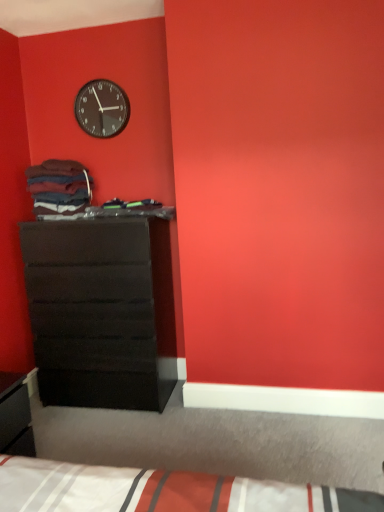
The width and height of the screenshot is (384, 512). I want to click on matte black chest of drawers at left, so click(99, 311).

Is matte black chest of drawers at left in front of matte black clock at upper left?

Yes, matte black chest of drawers at left is in front of matte black clock at upper left.

What's the angular difference between matte black chest of drawers at left and matte black clock at upper left's facing directions?

They differ by 2.42 degrees in their facing directions.

Is matte black chest of drawers at left not close to matte black clock at upper left?

Yes, matte black chest of drawers at left and matte black clock at upper left are quite far apart.

Who is bigger, matte black chest of drawers at left or matte black clock at upper left?

Bigger between the two is matte black chest of drawers at left.

Locate an element on the screen. Image resolution: width=384 pixels, height=512 pixels. bed below the matte black clock at upper left (from the image's perspective) is located at coordinates (161, 490).

Is white striped fabric bed at lower center wider than matte black clock at upper left?

Correct, the width of white striped fabric bed at lower center exceeds that of matte black clock at upper left.

Is the surface of white striped fabric bed at lower center in direct contact with matte black clock at upper left?

There is a gap between white striped fabric bed at lower center and matte black clock at upper left.

Is matte black chest of drawers at left not within white striped fabric bed at lower center?

matte black chest of drawers at left is positioned outside white striped fabric bed at lower center.

How different are the orientations of matte black chest of drawers at left and white striped fabric bed at lower center in degrees?

The facing directions of matte black chest of drawers at left and white striped fabric bed at lower center are 88.4 degrees apart.

Is matte black chest of drawers at left looking in the opposite direction of white striped fabric bed at lower center?

No, white striped fabric bed at lower center is not at the back of matte black chest of drawers at left.

Can you confirm if matte black chest of drawers at left is bigger than white striped fabric bed at lower center?

Indeed, matte black chest of drawers at left has a larger size compared to white striped fabric bed at lower center.

In the scene shown: Is matte black clock at upper left outside of matte black chest of drawers at left?

matte black clock at upper left is positioned outside matte black chest of drawers at left.

From the image's perspective, does matte black clock at upper left appear lower than matte black chest of drawers at left?

Actually, matte black clock at upper left appears above matte black chest of drawers at left in the image.

How much distance is there between matte black clock at upper left and matte black chest of drawers at left?

The distance of matte black clock at upper left from matte black chest of drawers at left is 1.13 meters.

Is matte black clock at upper left aimed at matte black chest of drawers at left?

No, matte black clock at upper left is not aimed at matte black chest of drawers at left.

Which is behind, point (108, 89) or point (74, 501)?

Point (108, 89)

Can white striped fabric bed at lower center be found inside matte black clock at upper left?

Actually, white striped fabric bed at lower center is outside matte black clock at upper left.

Identify the location of bed on the right side of matte black clock at upper left. (161, 490).

Is white striped fabric bed at lower center in front of or behind matte black chest of drawers at left in the image?

Clearly, white striped fabric bed at lower center is in front of matte black chest of drawers at left.

From the image's perspective, relative to matte black chest of drawers at left, is white striped fabric bed at lower center above or below?

From the image's perspective, white striped fabric bed at lower center appears below matte black chest of drawers at left.

Consider the image. Considering the relative sizes of white striped fabric bed at lower center and matte black chest of drawers at left in the image provided, is white striped fabric bed at lower center wider than matte black chest of drawers at left?

Yes.

Which is in front, point (316, 504) or point (118, 274)?

Positioned in front is point (316, 504).

Locate an element on the screen. the chest of drawers beneath the matte black clock at upper left (from a real-world perspective) is located at coordinates click(99, 311).

In order to click on wall clock located behind the white striped fabric bed at lower center in this screenshot , I will do `click(102, 108)`.

From the image, which object appears to be farther from matte black clock at upper left, matte black chest of drawers at left or white striped fabric bed at lower center?

Based on the image, white striped fabric bed at lower center appears to be further to matte black clock at upper left.

Looking at the image, which one is located closer to matte black clock at upper left, white striped fabric bed at lower center or matte black chest of drawers at left?

matte black chest of drawers at left.

Estimate the real-world distances between objects in this image. Which object is further from white striped fabric bed at lower center, matte black chest of drawers at left or matte black clock at upper left?

matte black clock at upper left lies further to white striped fabric bed at lower center than the other object.

When comparing their distances from white striped fabric bed at lower center, does matte black clock at upper left or matte black chest of drawers at left seem further?

Among the two, matte black clock at upper left is located further to white striped fabric bed at lower center.

From the picture: From the image, which object appears to be nearer to matte black chest of drawers at left, matte black clock at upper left or white striped fabric bed at lower center?

matte black clock at upper left is closer to matte black chest of drawers at left.

Based on their spatial positions, is white striped fabric bed at lower center or matte black clock at upper left closer to matte black chest of drawers at left?

matte black clock at upper left.

At what (x,y) coordinates should I click in order to perform the action: click on chest of drawers between matte black clock at upper left and white striped fabric bed at lower center from top to bottom. Please return your answer as a coordinate pair (x, y). The image size is (384, 512). Looking at the image, I should click on (99, 311).